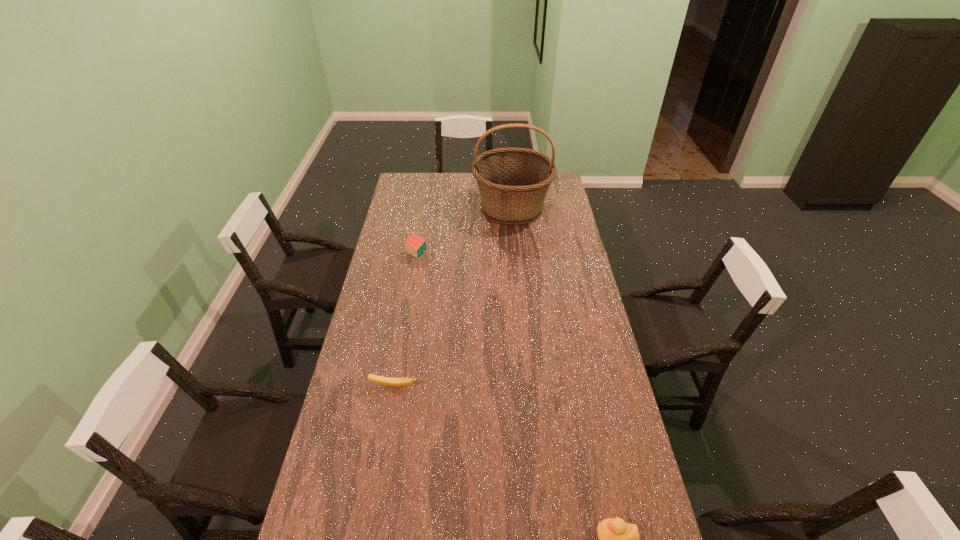
Locate an element on the screen. banana located at the left edge is located at coordinates (381, 380).

The height and width of the screenshot is (540, 960). Find the location of `object that is at the right edge`. object that is at the right edge is located at coordinates (513, 182).

Identify the location of object that is at the far right corner. This screenshot has height=540, width=960. (513, 182).

The height and width of the screenshot is (540, 960). I want to click on free space at the far edge of the desktop, so click(454, 191).

The image size is (960, 540). In order to click on free space at the left edge of the desktop in this screenshot , I will do `click(416, 198)`.

You are a GUI agent. You are given a task and a screenshot of the screen. Output one action in this format:
    pyautogui.click(x=<x>, y=<y>)
    Task: Click on the blank area at the right edge
    The image size is (960, 540).
    Given the screenshot: What is the action you would take?
    pyautogui.click(x=552, y=253)

This screenshot has width=960, height=540. In order to click on blank region between the tallest object and the cube in this screenshot , I will do `click(464, 231)`.

This screenshot has height=540, width=960. Find the location of `vacant area that lies between the shortest object and the farthest object`. vacant area that lies between the shortest object and the farthest object is located at coordinates (453, 297).

Find the location of a particular element. Image resolution: width=960 pixels, height=540 pixels. vacant area between the cube and the banana is located at coordinates (405, 320).

Locate an element on the screen. Image resolution: width=960 pixels, height=540 pixels. vacant space that is in between the tallest object and the cube is located at coordinates (464, 231).